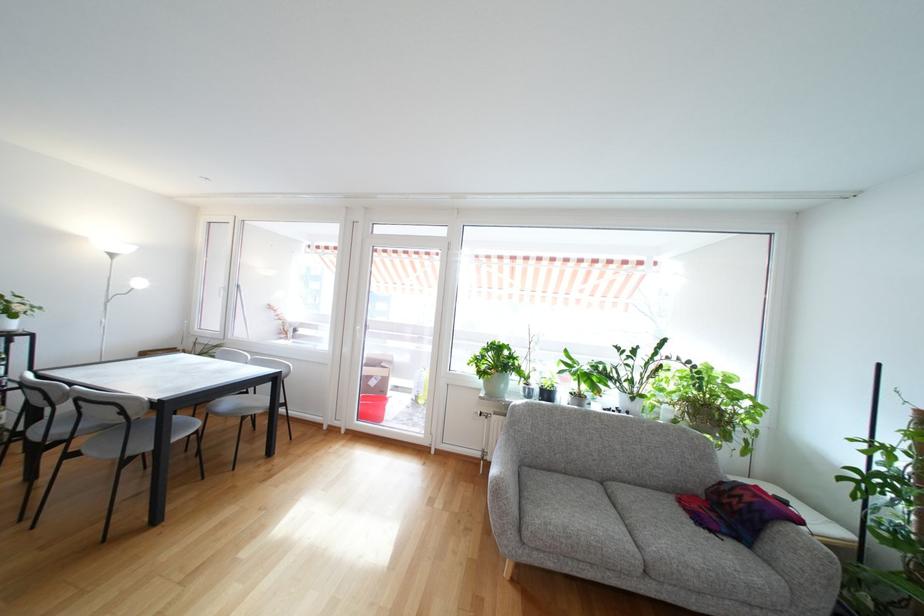
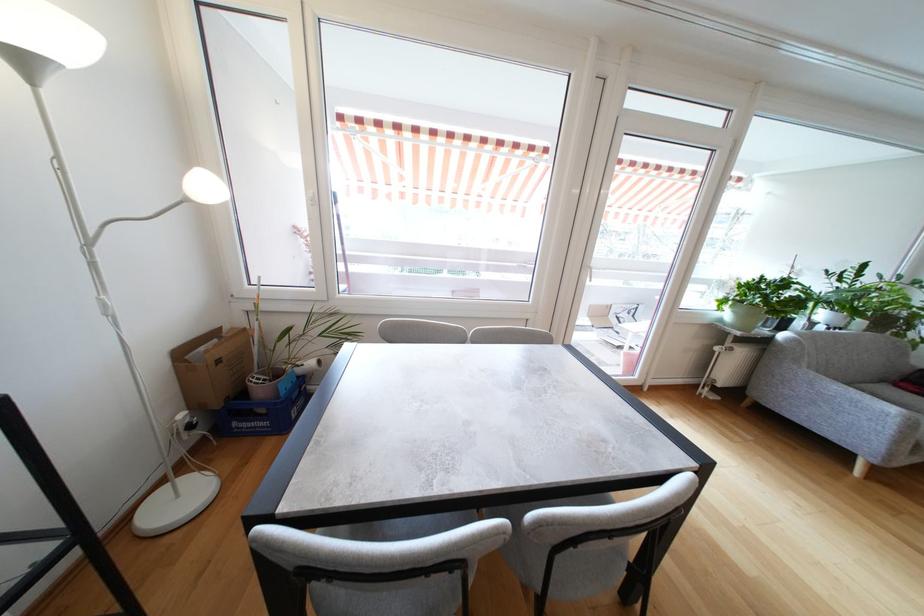
In the second image, find the point that corresponds to point 113,304 in the first image.

(93, 246)